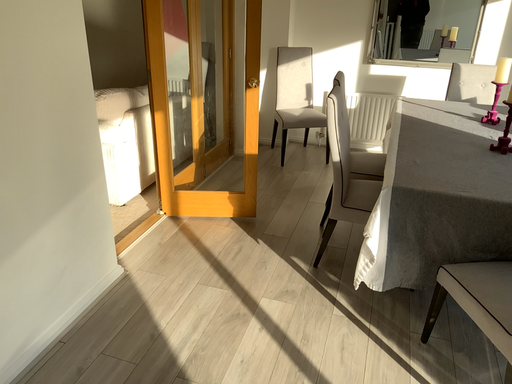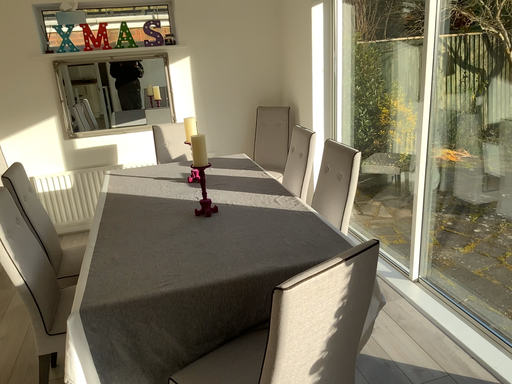
Question: How did the camera likely rotate when shooting the video?

Choices:
 (A) rotated right
 (B) rotated left

Answer: (A)